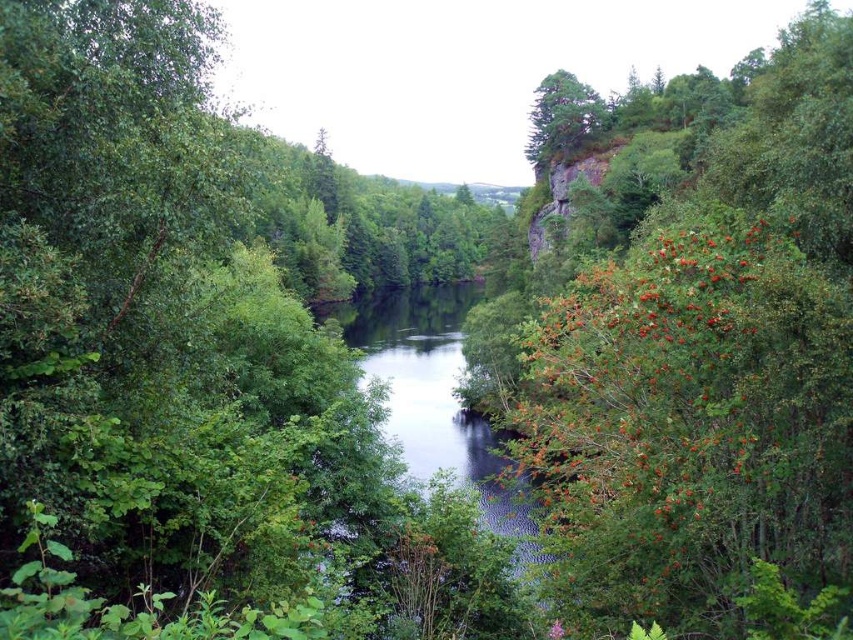
You are a bird looking for a place to perch. You see the green leafy tree at right and the clear water at center. Which location would allow you to perch higher?

The green leafy tree at right has a greater height compared to the clear water at center, so you can perch higher on the green leafy tree at right.